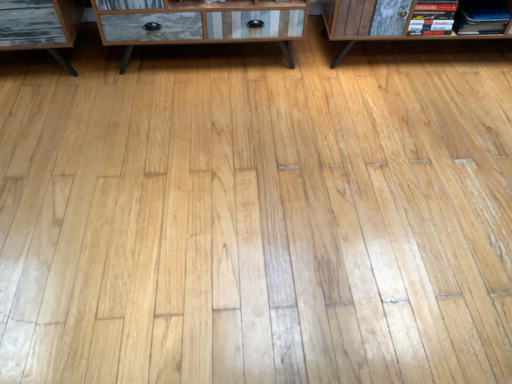
At what (x,y) coordinates should I click in order to perform the action: click on matte black book at upper right, the second book from the left. Please return your answer as a coordinate pair (x, y). Image resolution: width=512 pixels, height=384 pixels. Looking at the image, I should click on (459, 17).

Image resolution: width=512 pixels, height=384 pixels. In order to click on wooden cabinet at center in this screenshot , I will do pos(199,22).

In order to click on hardcover book at upper right, arranged as the 1th book when viewed from the left in this screenshot , I will do `click(432, 17)`.

You are a GUI agent. You are given a task and a screenshot of the screen. Output one action in this format:
    pyautogui.click(x=<x>, y=<y>)
    Task: Click on the matte black book at upper right, which ranks as the 1th book in right-to-left order
    This screenshot has width=512, height=384.
    Given the screenshot: What is the action you would take?
    pyautogui.click(x=459, y=17)

Is wooden cabinet at center smaller than hardcover book at upper right, arranged as the 1th book when viewed from the left?

No.

Which of these two, wooden cabinet at center or hardcover book at upper right, placed as the second book when sorted from right to left, stands shorter?

hardcover book at upper right, placed as the second book when sorted from right to left, is shorter.

Considering the points (170, 8) and (433, 8), which point is in front, point (170, 8) or point (433, 8)?

Positioned in front is point (170, 8).

From a real-world perspective, relative to hardcover book at upper right, placed as the second book when sorted from right to left, is wooden cabinet at center vertically above or below?

From a real-world perspective, wooden cabinet at center is physically below hardcover book at upper right, placed as the second book when sorted from right to left.

Is hardcover book at upper right, arranged as the 1th book when viewed from the left, positioned with its back to matte black book at upper right, the second book from the left?

That's not correct — hardcover book at upper right, arranged as the 1th book when viewed from the left, is not looking away from matte black book at upper right, the second book from the left.

Find the location of `book below the hardcover book at upper right, placed as the second book when sorted from right to left (from a real-world perspective)`. book below the hardcover book at upper right, placed as the second book when sorted from right to left (from a real-world perspective) is located at coordinates (459, 17).

Is hardcover book at upper right, placed as the second book when sorted from right to left, surrounding matte black book at upper right, which ranks as the 1th book in right-to-left order?

No, matte black book at upper right, which ranks as the 1th book in right-to-left order, is not surrounded by hardcover book at upper right, placed as the second book when sorted from right to left.

Which object is closer to the camera taking this photo, hardcover book at upper right, placed as the second book when sorted from right to left, or matte black book at upper right, the second book from the left?

hardcover book at upper right, placed as the second book when sorted from right to left, is more forward.

From the image's perspective, which one is positioned lower, matte black book at upper right, the second book from the left, or wooden cabinet at center?

matte black book at upper right, the second book from the left.

Which of these two, matte black book at upper right, which ranks as the 1th book in right-to-left order, or wooden cabinet at center, is thinner?

matte black book at upper right, which ranks as the 1th book in right-to-left order.

Is point (409, 34) farther from viewer compared to point (194, 16)?

That is True.

Which object is positioned more to the right, wooden cabinet at center or matte black book at upper right, which ranks as the 1th book in right-to-left order?

Positioned to the right is matte black book at upper right, which ranks as the 1th book in right-to-left order.

From the image's perspective, between wooden cabinet at center and matte black book at upper right, which ranks as the 1th book in right-to-left order, who is located below?

matte black book at upper right, which ranks as the 1th book in right-to-left order, from the image's perspective.

Between wooden cabinet at center and matte black book at upper right, which ranks as the 1th book in right-to-left order, which one has smaller width?

matte black book at upper right, which ranks as the 1th book in right-to-left order.

Is matte black book at upper right, the second book from the left, wider than hardcover book at upper right, placed as the second book when sorted from right to left?

Yes, matte black book at upper right, the second book from the left, is wider than hardcover book at upper right, placed as the second book when sorted from right to left.

At what (x,y) coordinates should I click in order to perform the action: click on book above the matte black book at upper right, the second book from the left (from the image's perspective). Please return your answer as a coordinate pair (x, y). Looking at the image, I should click on (432, 17).

Who is taller, matte black book at upper right, the second book from the left, or hardcover book at upper right, placed as the second book when sorted from right to left?

hardcover book at upper right, placed as the second book when sorted from right to left.

Considering the sizes of objects hardcover book at upper right, arranged as the 1th book when viewed from the left, and wooden cabinet at center in the image provided, who is smaller, hardcover book at upper right, arranged as the 1th book when viewed from the left, or wooden cabinet at center?

Smaller between the two is hardcover book at upper right, arranged as the 1th book when viewed from the left.

Based on the photo, which point is more forward, [450,19] or [110,25]?

The point [110,25] is closer.

Which object is further away from the camera, hardcover book at upper right, placed as the second book when sorted from right to left, or wooden cabinet at center?

Positioned behind is hardcover book at upper right, placed as the second book when sorted from right to left.

Are hardcover book at upper right, arranged as the 1th book when viewed from the left, and wooden cabinet at center far apart?

No.

This screenshot has height=384, width=512. In order to click on the 1st book to the right of the wooden cabinet at center, counting from the anchor's position in this screenshot , I will do `click(432, 17)`.

Where is `book above the matte black book at upper right, which ranks as the 1th book in right-to-left order (from a real-world perspective)`? This screenshot has width=512, height=384. book above the matte black book at upper right, which ranks as the 1th book in right-to-left order (from a real-world perspective) is located at coordinates (432, 17).

When comparing their distances from wooden cabinet at center, does matte black book at upper right, the second book from the left, or hardcover book at upper right, placed as the second book when sorted from right to left, seem further?

Based on the image, matte black book at upper right, the second book from the left, appears to be further to wooden cabinet at center.

From the image, which object appears to be nearer to hardcover book at upper right, placed as the second book when sorted from right to left, matte black book at upper right, which ranks as the 1th book in right-to-left order, or wooden cabinet at center?

matte black book at upper right, which ranks as the 1th book in right-to-left order, lies closer to hardcover book at upper right, placed as the second book when sorted from right to left, than the other object.

Considering their positions, is hardcover book at upper right, placed as the second book when sorted from right to left, positioned further to wooden cabinet at center than matte black book at upper right, which ranks as the 1th book in right-to-left order?

matte black book at upper right, which ranks as the 1th book in right-to-left order, lies further to wooden cabinet at center than the other object.

Estimate the real-world distances between objects in this image. Which object is further from matte black book at upper right, which ranks as the 1th book in right-to-left order, hardcover book at upper right, placed as the second book when sorted from right to left, or wooden cabinet at center?

wooden cabinet at center is further to matte black book at upper right, which ranks as the 1th book in right-to-left order.

Considering their positions, is wooden cabinet at center positioned further to matte black book at upper right, the second book from the left, than hardcover book at upper right, placed as the second book when sorted from right to left?

wooden cabinet at center.

Considering their positions, is wooden cabinet at center positioned further to hardcover book at upper right, arranged as the 1th book when viewed from the left, than matte black book at upper right, which ranks as the 1th book in right-to-left order?

wooden cabinet at center is further to hardcover book at upper right, arranged as the 1th book when viewed from the left.

This screenshot has height=384, width=512. Find the location of `book between wooden cabinet at center and matte black book at upper right, which ranks as the 1th book in right-to-left order`. book between wooden cabinet at center and matte black book at upper right, which ranks as the 1th book in right-to-left order is located at coordinates (432, 17).